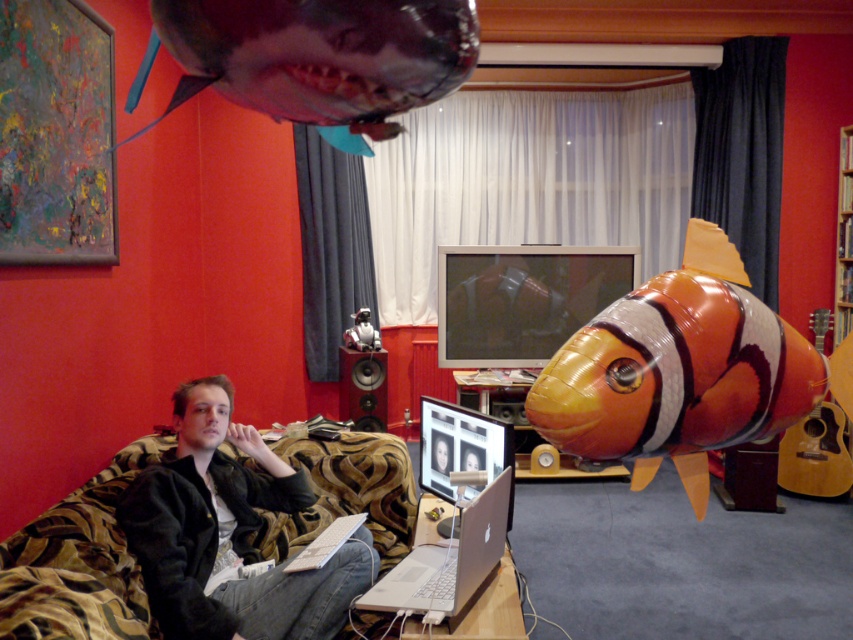
Is shiny metallic shark at upper center below matte black speaker at center?

Actually, shiny metallic shark at upper center is above matte black speaker at center.

Which is below, shiny metallic shark at upper center or matte black speaker at center?

matte black speaker at center

What do you see at coordinates (323, 54) in the screenshot? This screenshot has width=853, height=640. I see `shiny metallic shark at upper center` at bounding box center [323, 54].

This screenshot has width=853, height=640. I want to click on shiny metallic shark at upper center, so click(323, 54).

Is point (567, 346) positioned in front of point (380, 356)?

That is True.

Which is more to the right, orange matte clownfish at right or matte black speaker at center?

orange matte clownfish at right is more to the right.

Between point (752, 352) and point (367, 424), which one is positioned behind?

The point (367, 424) is behind.

Where is `orange matte clownfish at right`? This screenshot has width=853, height=640. orange matte clownfish at right is located at coordinates (675, 372).

Can you confirm if wooden at right is positioned to the left of matte black speaker at center?

Incorrect, wooden at right is not on the left side of matte black speaker at center.

Who is more distant from viewer, (846, 230) or (338, 353)?

The point (338, 353) is behind.

The width and height of the screenshot is (853, 640). I want to click on wooden at right, so click(x=843, y=243).